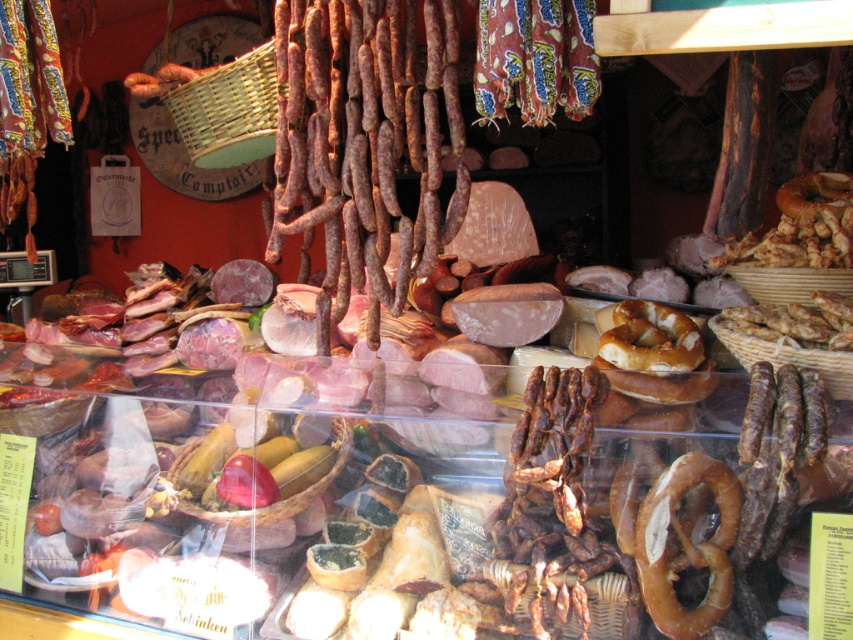
Question: Which point appears farthest from the camera in this image?

Choices:
 (A) (670, 579)
 (B) (646, 353)
 (C) (827, 184)

Answer: (C)

Question: Is brown/crumbly bagel at center thinner than brown matte bagel at center-right?

Choices:
 (A) yes
 (B) no

Answer: (B)

Question: Which object is closer to the camera taking this photo?

Choices:
 (A) golden brown pretzel at center
 (B) brown matte bagel at center-right
 (C) brown/crumbly bagel at center

Answer: (A)

Question: Does golden brown pretzel at center have a larger size compared to brown/crumbly bagel at center?

Choices:
 (A) no
 (B) yes

Answer: (A)

Question: Observing the image, what is the correct spatial positioning of brown/crumbly bagel at center in reference to brown matte bagel at center-right?

Choices:
 (A) below
 (B) above

Answer: (A)

Question: Estimate the real-world distances between objects in this image. Which object is closer to the brown matte bagel at center-right?

Choices:
 (A) brown/crumbly bagel at center
 (B) golden brown pretzel at center

Answer: (A)